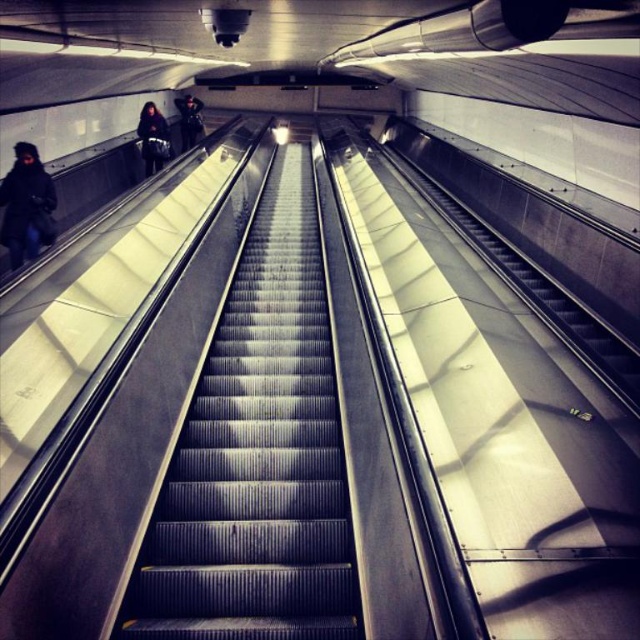
Who is taller, metallic gray stairs at center or dark blue fabric jacket at left?

metallic gray stairs at center is taller.

Between metallic gray stairs at center and dark blue fabric jacket at left, which one is positioned lower?

Positioned lower is metallic gray stairs at center.

Between point (177, 586) and point (40, 179), which one is positioned behind?

Positioned behind is point (40, 179).

Locate an element on the screen. The width and height of the screenshot is (640, 640). metallic gray stairs at center is located at coordinates (257, 456).

Can you confirm if dark blue fabric jacket at left is positioned above dark blue jacket at center?

No.

Is dark blue fabric jacket at left below dark blue jacket at center?

Indeed, dark blue fabric jacket at left is positioned under dark blue jacket at center.

Between point (6, 180) and point (188, 129), which one is positioned behind?

The point (188, 129) is more distant.

At what (x,y) coordinates should I click in order to perform the action: click on dark blue fabric jacket at left. Please return your answer as a coordinate pair (x, y). Image resolution: width=640 pixels, height=640 pixels. Looking at the image, I should click on (26, 205).

Who is more distant from viewer, (1, 204) or (163, 116)?

Point (163, 116)

I want to click on dark blue fabric jacket at left, so pyautogui.click(x=26, y=205).

Is point (1, 228) farther from camera compared to point (157, 125)?

No, (1, 228) is closer to viewer.

Image resolution: width=640 pixels, height=640 pixels. Find the location of `dark blue fabric jacket at left`. dark blue fabric jacket at left is located at coordinates (26, 205).